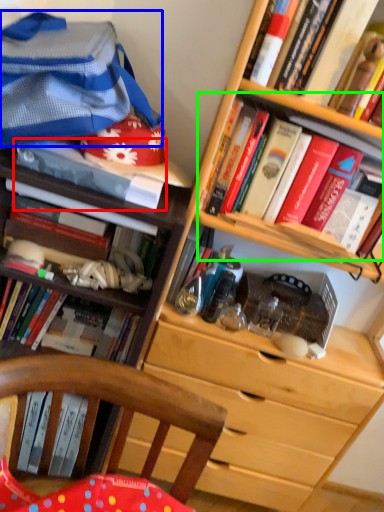
Question: Considering the real-world distances, which object is farthest from book (highlighted by a red box)? clothing (highlighted by a blue box) or book (highlighted by a green box)?

Choices:
 (A) clothing
 (B) book

Answer: (B)